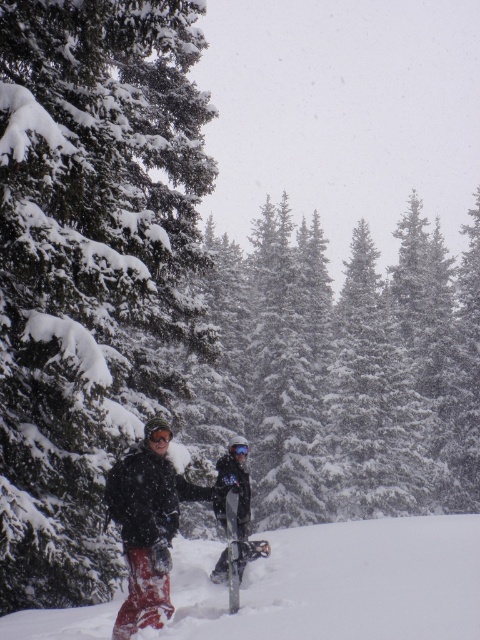
Question: Estimate the real-world distances between objects in this image. Which object is farther from the silver metallic snowshoe at center?

Choices:
 (A) red snowboard at lower left
 (B) snowboard at center
 (C) matte black snowshoe at center

Answer: (A)

Question: Is snow-covered evergreen tree at left positioned before red snowboard at lower left?

Choices:
 (A) yes
 (B) no

Answer: (B)

Question: Which object appears farthest from the camera in this image?

Choices:
 (A) silver metallic snowshoe at center
 (B) snowboard at center
 (C) matte black snowshoe at center

Answer: (C)

Question: Which point is farther from the camera taking this photo?

Choices:
 (A) (232, 486)
 (B) (95, 61)
 (C) (134, 483)

Answer: (A)

Question: Is red snowboard at lower left positioned before matte black snowshoe at center?

Choices:
 (A) yes
 (B) no

Answer: (A)

Question: Does red snowboard at lower left appear over silver metallic snowshoe at center?

Choices:
 (A) no
 (B) yes

Answer: (A)